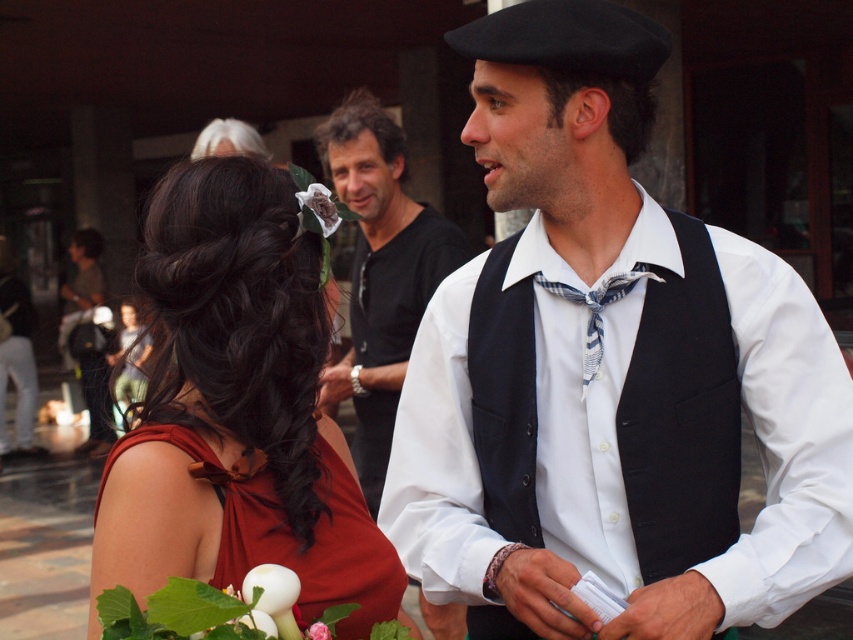
You are a photographer at the event and want to capture a photo focusing on the blue plaid bow tie at center. However, the matte red dress at lower left is blocking your view. Can you adjust your position to avoid the dress?

The matte red dress at lower left is closer to the viewer than the blue plaid bow tie at center, so moving your position slightly to the right or left might allow you to angle around the dress to capture the bow tie without obstruction.

You are organizing a fashion show and need to place two red dresses on the runway. The shiny red dress at center and the matte red dress at lower left must be spaced exactly 6 centimeters apart. Can you position them correctly based on their current distance?

The shiny red dress at center and the matte red dress at lower left are currently 6.24 centimeters apart, which is slightly more than the required 6 centimeters. You can adjust their positions to reduce the distance by 0.24 centimeters to meet the exact requirement.

You are a photographer at the event and need to ensure both the shiny red dress at center and the white matte flower at center are visible in your shot. Based on their sizes, which one will appear larger in the photo?

The shiny red dress at center is taller than the white matte flower at center, so it will appear larger in the photo.